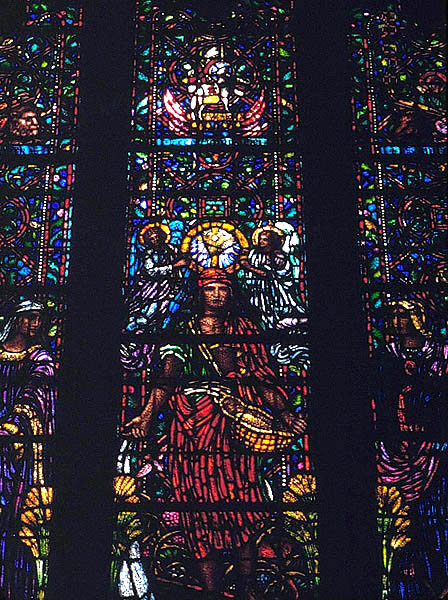
Find the location of a particular element. This screenshot has width=448, height=600. left colored window is located at coordinates (44, 249).